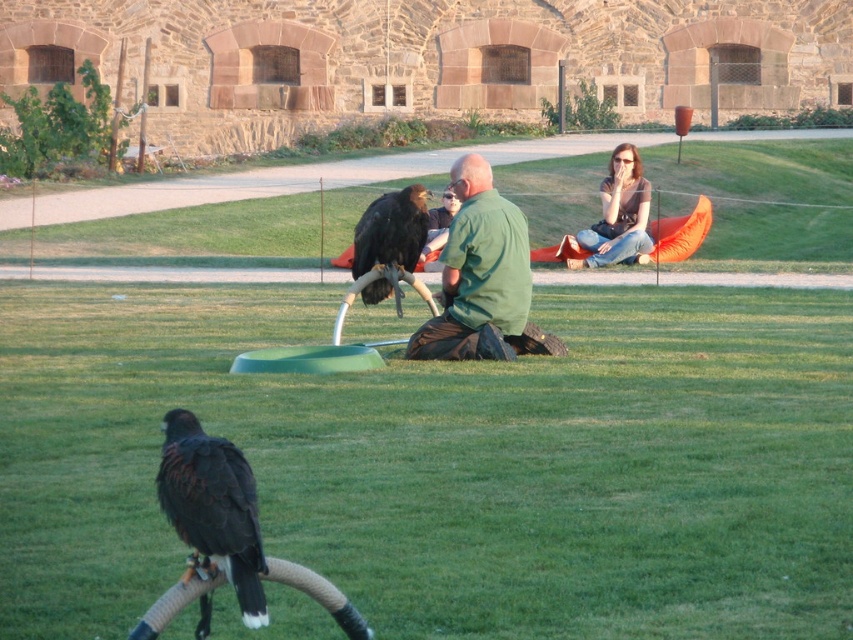
Question: Estimate the real-world distances between objects in this image. Which object is closer to the dark brown hair at upper right?

Choices:
 (A) black feathered eagle at lower left
 (B) green matte shirt at center

Answer: (B)

Question: Is green matte shirt at center positioned in front of dark brown hair at upper right?

Choices:
 (A) yes
 (B) no

Answer: (A)

Question: Among these objects, which one is farthest from the camera?

Choices:
 (A) dark brown hair at upper right
 (B) green matte shirt at center

Answer: (A)

Question: Does black feathered eagle at lower left have a lesser width compared to dark brown feathers at center?

Choices:
 (A) yes
 (B) no

Answer: (A)

Question: Which object is the closest to the green matte shirt at center?

Choices:
 (A) dark brown hair at upper right
 (B) black feathered eagle at lower left
 (C) dark brown feathers at center

Answer: (C)

Question: Can you confirm if black feathered eagle at lower left is positioned below dark brown hair at upper right?

Choices:
 (A) yes
 (B) no

Answer: (A)